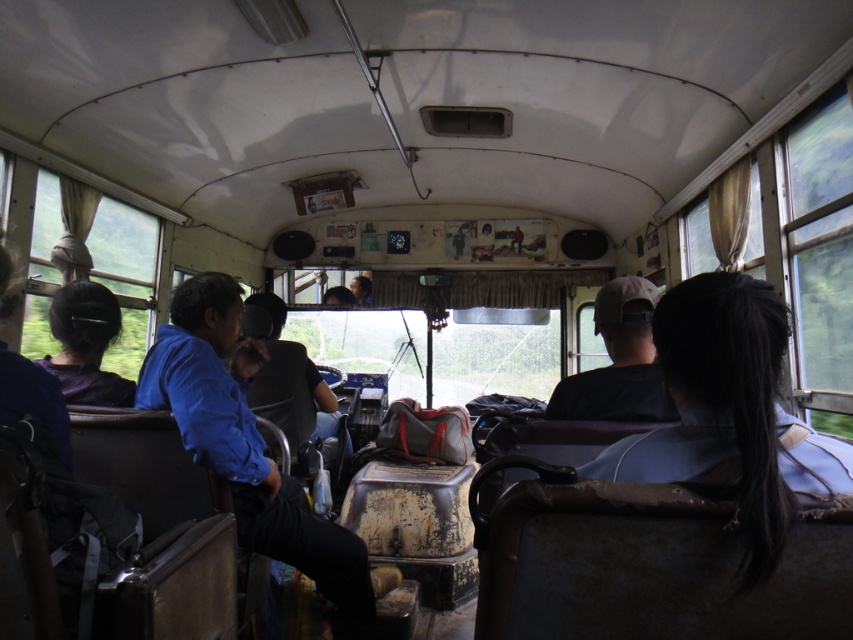
Question: Does blue fabric shirt at left appear under black hair at left?

Choices:
 (A) yes
 (B) no

Answer: (A)

Question: Among these points, which one is farthest from the camera?

Choices:
 (A) (56, 291)
 (B) (610, 400)
 (C) (207, 348)

Answer: (A)

Question: Is blue fabric shirt at left thinner than black hair at left?

Choices:
 (A) yes
 (B) no

Answer: (B)

Question: Which point is farther to the camera?

Choices:
 (A) (360, 592)
 (B) (643, 410)

Answer: (A)

Question: Which point appears closest to the camera in this image?

Choices:
 (A) (97, 403)
 (B) (167, 364)
 (C) (596, 406)

Answer: (C)

Question: Can you confirm if blue fabric shirt at left is positioned above black hair at left?

Choices:
 (A) yes
 (B) no

Answer: (B)